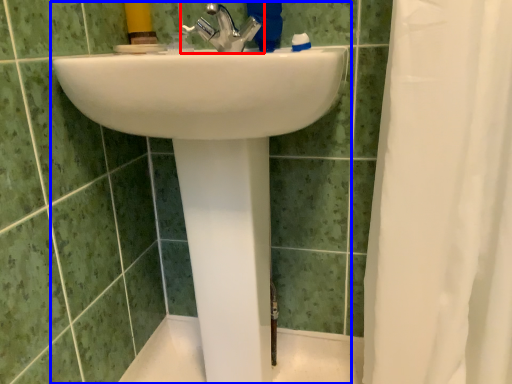
Question: Which object appears closest to the camera in this image, tap (highlighted by a red box) or sink (highlighted by a blue box)?

Choices:
 (A) tap
 (B) sink

Answer: (B)